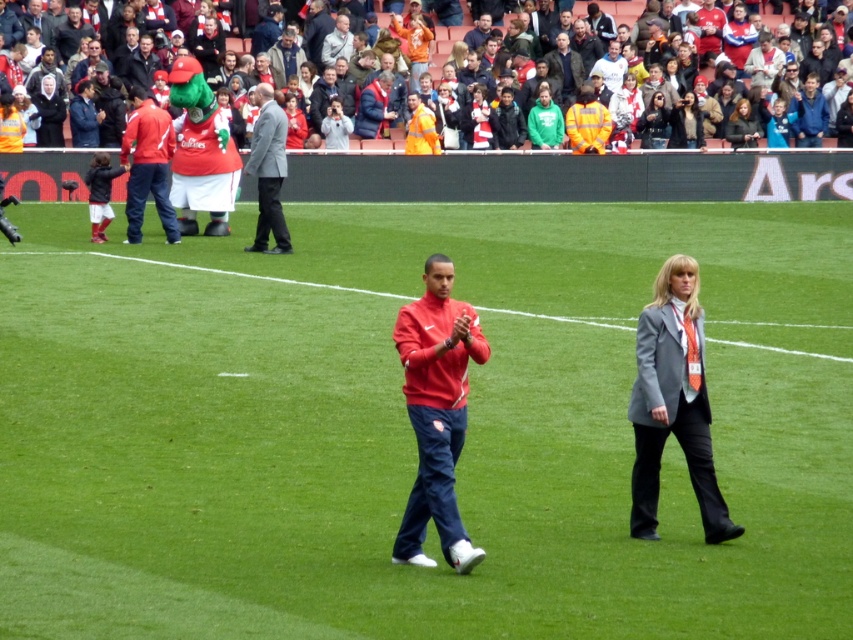
Who is more distant from viewer, (259, 113) or (506, 19)?

The point (506, 19) is behind.

What do you see at coordinates (268, 172) in the screenshot? I see `gray suit at center` at bounding box center [268, 172].

Who is more distant from viewer, (253, 100) or (506, 16)?

The point (506, 16) is behind.

What are the coordinates of `gray suit at center` in the screenshot? It's located at (268, 172).

Does green grass at center have a greater width compared to matte red jacket at upper left?

Yes.

Where is `green grass at center`? This screenshot has height=640, width=853. green grass at center is located at coordinates (410, 429).

Who is more forward, (325, 369) or (141, 204)?

Point (325, 369) is more forward.

Locate an element on the screen. green grass at center is located at coordinates (410, 429).

Locate an element on the screen. The width and height of the screenshot is (853, 640). gray suit at center is located at coordinates (268, 172).

Is point (248, 166) less distant than point (335, 28)?

Yes, it is.

The width and height of the screenshot is (853, 640). I want to click on gray suit at center, so click(x=268, y=172).